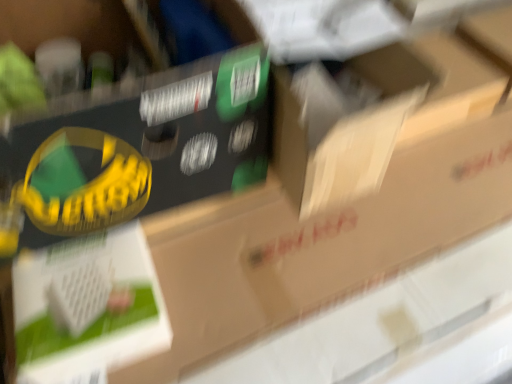
Question: Is cardboard box at center inside cardboard box at center?

Choices:
 (A) yes
 (B) no

Answer: (B)

Question: From a real-world perspective, does cardboard box at center sit lower than cardboard box at center?

Choices:
 (A) yes
 (B) no

Answer: (B)

Question: Does cardboard box at center have a lesser width compared to cardboard box at center?

Choices:
 (A) yes
 (B) no

Answer: (A)

Question: Is cardboard box at center not inside cardboard box at center?

Choices:
 (A) no
 (B) yes

Answer: (A)

Question: Are cardboard box at center and cardboard box at center located far from each other?

Choices:
 (A) no
 (B) yes

Answer: (A)

Question: Considering the relative sizes of cardboard box at center and cardboard box at center in the image provided, is cardboard box at center shorter than cardboard box at center?

Choices:
 (A) yes
 (B) no

Answer: (A)

Question: Does cardboard box at center have a smaller size compared to cardboard box at center?

Choices:
 (A) yes
 (B) no

Answer: (B)

Question: From the image's perspective, does cardboard box at center appear lower than cardboard box at center?

Choices:
 (A) yes
 (B) no

Answer: (B)

Question: From a real-world perspective, is cardboard box at center under cardboard box at center?

Choices:
 (A) yes
 (B) no

Answer: (A)

Question: Is cardboard box at center directly adjacent to cardboard box at center?

Choices:
 (A) no
 (B) yes

Answer: (A)

Question: Does cardboard box at center lie behind cardboard box at center?

Choices:
 (A) yes
 (B) no

Answer: (B)

Question: Considering the relative positions of cardboard box at center and cardboard box at center in the image provided, is cardboard box at center to the left of cardboard box at center from the viewer's perspective?

Choices:
 (A) no
 (B) yes

Answer: (B)

Question: In terms of width, does cardboard box at center look wider or thinner when compared to cardboard box at center?

Choices:
 (A) thin
 (B) wide

Answer: (A)